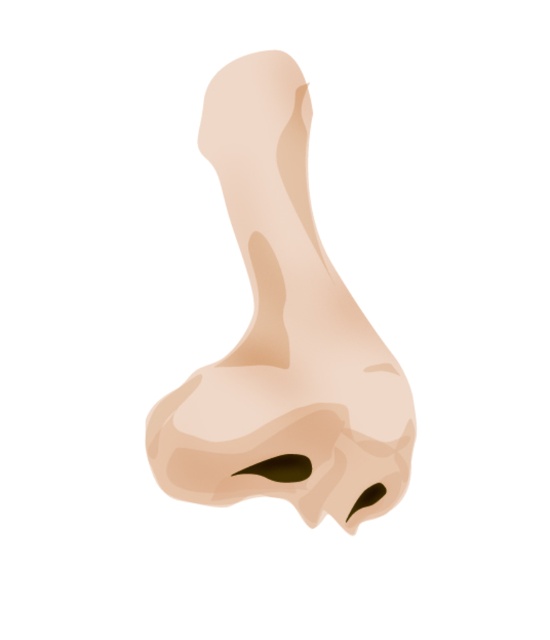
You are a sculptor working on a detailed model of the nose shown in the image. You need to ensure that the two nostrils are precisely spaced. Given that the distance between the matte black nostril at center and the black matte nostril at center must be exactly 2 inches for anatomical accuracy, is the current spacing correct?

The distance between the matte black nostril at center and the black matte nostril at center is 1.99 inches, which is just 0.01 inches less than the required 2 inches. This slight discrepancy might be considered acceptable depending on the project requirements, but technically it does not meet the exact 2 inch specification.

What is the difference between the matte black nostril at center and the black matte nostril at center in terms of width?

The matte black nostril at center is wider than the black matte nostril at center according to the description.

You are a sculptor working on a life size nose sculpture. You have the matte beige nose at center and the black matte nostril at center. The client wants the nostril to be placed exactly 6.46 inches away from the nose. Can you confirm if the current placement meets the client requirement?

Yes, the distance between the matte beige nose at center and the black matte nostril at center is exactly 6.46 inches, so the current placement meets the client requirement.